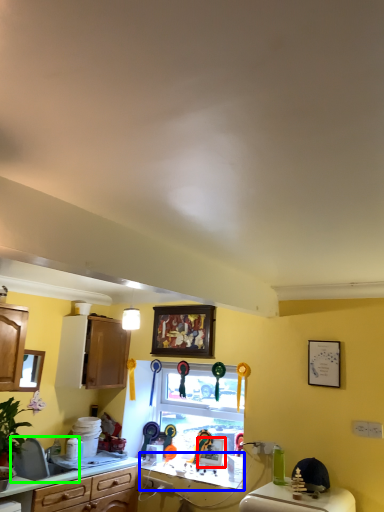
Question: Estimate the real-world distances between objects in this image. Which object is closer to picture frame (highlighted by a red box), counter top (highlighted by a blue box) or sink (highlighted by a green box)?

Choices:
 (A) counter top
 (B) sink

Answer: (A)